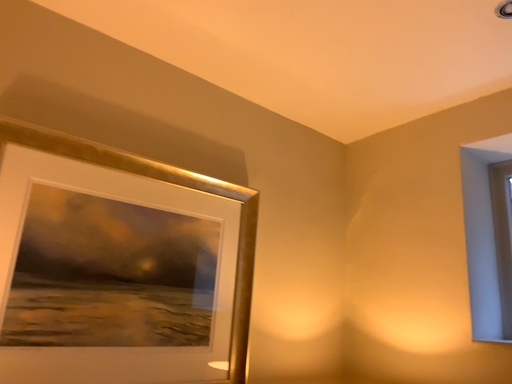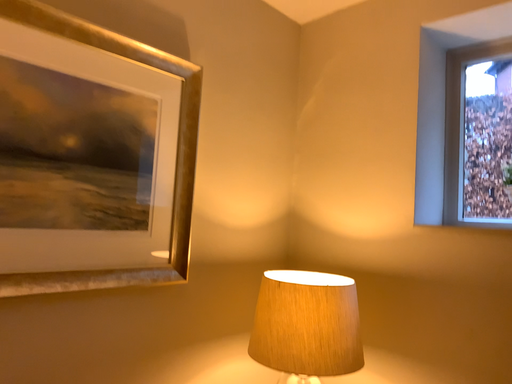
Question: How did the camera likely rotate when shooting the video?

Choices:
 (A) rotated downward
 (B) rotated upward

Answer: (A)